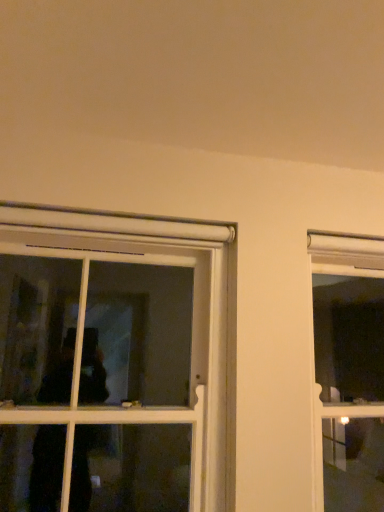
Question: From the image's perspective, is white plastic window at left, which is counted as the second window, starting from the right, above or below clear glass window at right, which is the second window from left to right?

Choices:
 (A) below
 (B) above

Answer: (B)

Question: Is white plastic window at left, the 1th window viewed from the left, bigger or smaller than clear glass window at right, which is counted as the 1th window, starting from the right?

Choices:
 (A) small
 (B) big

Answer: (B)

Question: Looking at their shapes, would you say white plastic window at left, which is counted as the second window, starting from the right, is wider or thinner than clear glass window at right, which is counted as the 1th window, starting from the right?

Choices:
 (A) thin
 (B) wide

Answer: (A)

Question: Relative to white plastic window at left, which is counted as the second window, starting from the right, is clear glass window at right, which is counted as the 1th window, starting from the right, in front or behind?

Choices:
 (A) front
 (B) behind

Answer: (B)

Question: Looking at their shapes, would you say clear glass window at right, which is the second window from left to right, is wider or thinner than white plastic window at left, which is counted as the second window, starting from the right?

Choices:
 (A) wide
 (B) thin

Answer: (A)

Question: Is clear glass window at right, which is the second window from left to right, to the left or to the right of white plastic window at left, which is counted as the second window, starting from the right, in the image?

Choices:
 (A) right
 (B) left

Answer: (A)

Question: From a real-world perspective, is clear glass window at right, which is counted as the 1th window, starting from the right, positioned above or below white plastic window at left, which is counted as the second window, starting from the right?

Choices:
 (A) above
 (B) below

Answer: (B)